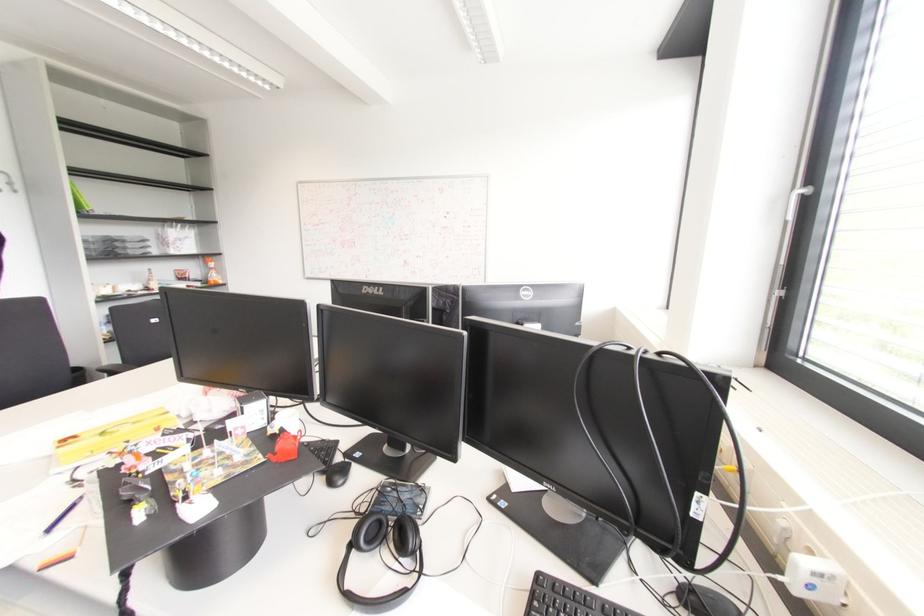
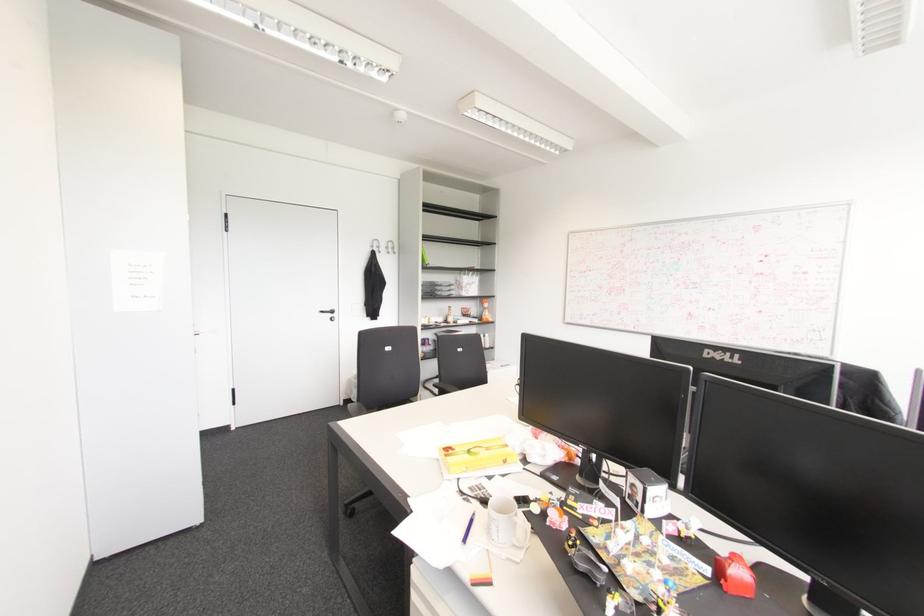
Find the pixel in the second image that matches point 156,429 in the first image.

(504, 461)